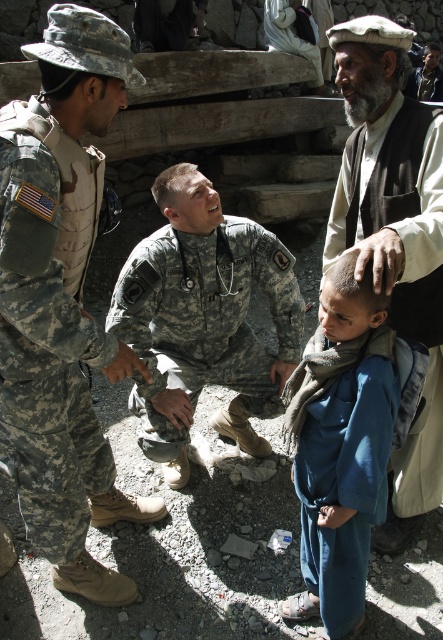
Question: Observing the image, what is the correct spatial positioning of camouflage fabric uniform at left in reference to blue cotton scarf at lower center?

Choices:
 (A) above
 (B) below

Answer: (A)

Question: Does camouflage fabric uniform at left appear over white cotton uniform at upper center?

Choices:
 (A) no
 (B) yes

Answer: (A)

Question: Observing the image, what is the correct spatial positioning of white woolen cap at upper right in reference to white cotton uniform at upper center?

Choices:
 (A) below
 (B) above

Answer: (A)

Question: Which of the following is the closest to the observer?

Choices:
 (A) camouflage fabric uniform at left
 (B) white cotton uniform at upper center
 (C) blue cotton scarf at lower center

Answer: (A)

Question: Which of the following is the closest to the observer?

Choices:
 (A) white cotton uniform at upper center
 (B) camouflage uniform at center

Answer: (B)

Question: Which of the following is the closest to the observer?

Choices:
 (A) (335, 534)
 (B) (375, 67)
 (C) (178, 472)

Answer: (A)